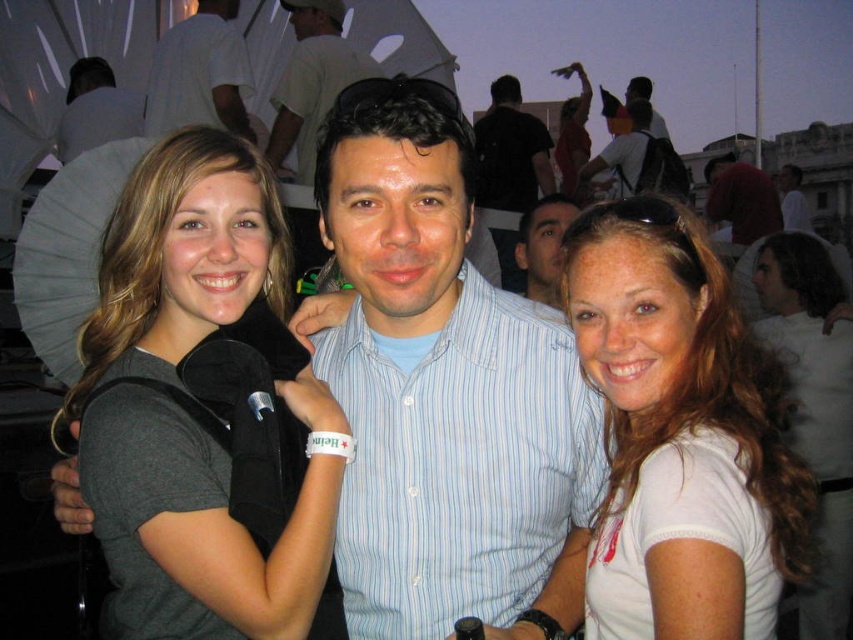
You are a photographer at the event and need to capture a clear photo of the matte blue shirt at center. The camera you are using has a maximum focus range of 70 meters. Can you take a clear photo from your current position?

The matte blue shirt at center and camera are 75.08 meters apart, which exceeds the camera maximum focus range of 70 meters. Therefore, you cannot take a clear photo from your current position.